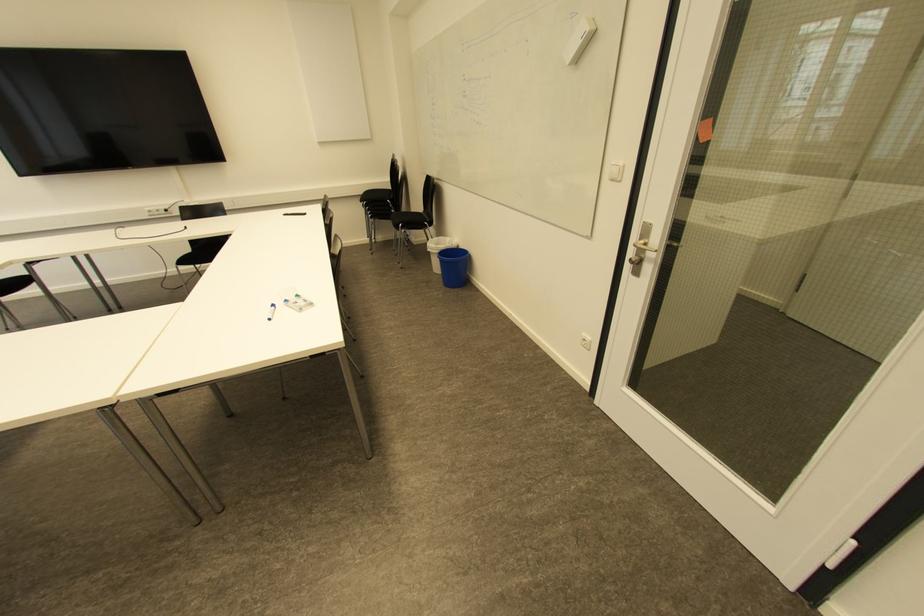
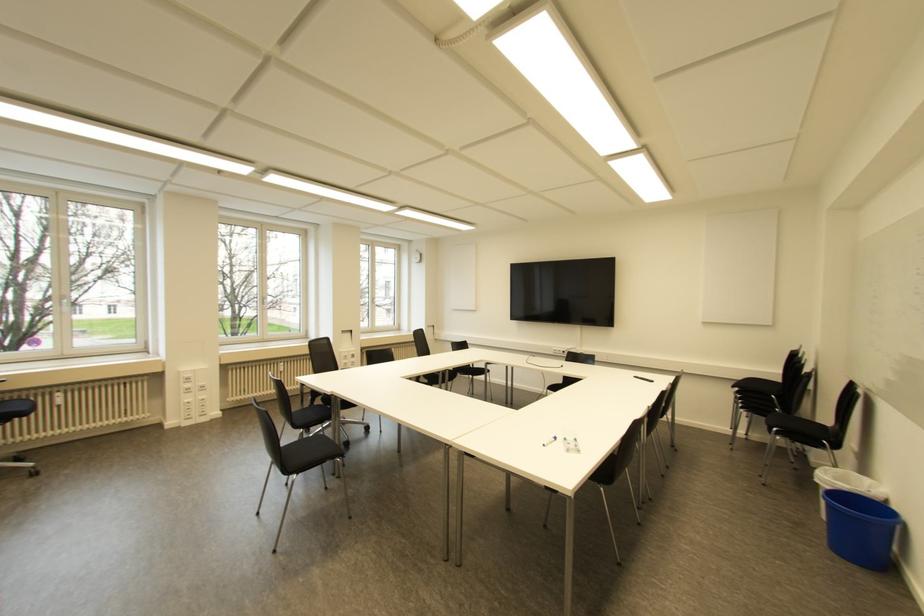
Find the pixel in the second image that matches (x=434, y=245) in the first image.

(829, 477)